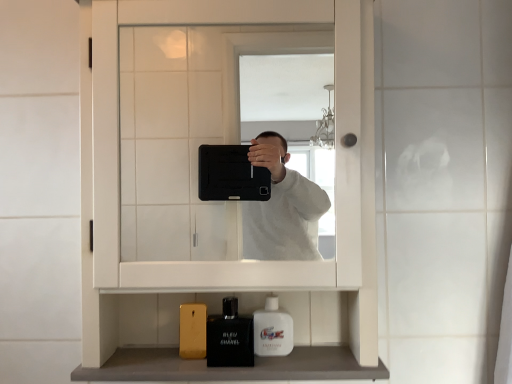
The width and height of the screenshot is (512, 384). Find the location of `free point below white matte medicine cabinet at center (from a real-world perspective)`. free point below white matte medicine cabinet at center (from a real-world perspective) is located at coordinates (219, 348).